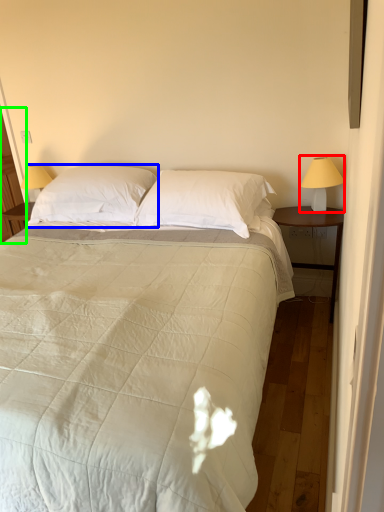
Question: Estimate the real-world distances between objects in this image. Which object is farther from bedside lamp (highlighted by a red box), pillow (highlighted by a blue box) or screen door (highlighted by a green box)?

Choices:
 (A) pillow
 (B) screen door

Answer: (B)